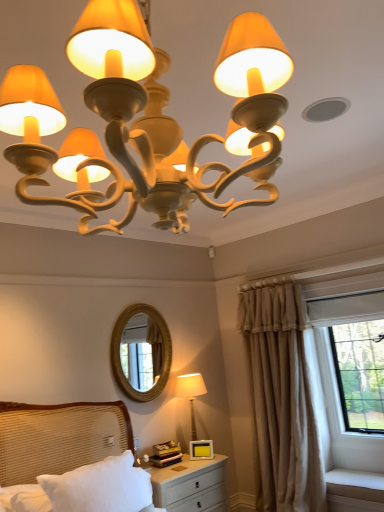
Question: From their relative heights in the image, would you say gold textured mirror at center is taller or shorter than matte cream lamp at lower center, placed as the 2th lamp when sorted from top to bottom?

Choices:
 (A) short
 (B) tall

Answer: (B)

Question: From the image's perspective, is gold textured mirror at center located above or below matte cream lamp at lower center, the 2th lamp positioned from the front?

Choices:
 (A) below
 (B) above

Answer: (B)

Question: Which of these objects is positioned farthest from the white textured bed at lower left?

Choices:
 (A) matte cream chandelier at upper center, the second lamp ordered from the bottom
 (B) matte cream lamp at lower center, the 2th lamp positioned from the front
 (C) beige fabric curtain at right
 (D) white matte nightstand at lower center
 (E) gold textured mirror at center

Answer: (A)

Question: Which object is the farthest from the matte cream lamp at lower center, placed as the 2th lamp when sorted from top to bottom?

Choices:
 (A) matte cream chandelier at upper center, the 2th lamp from the back
 (B) gold textured mirror at center
 (C) white matte nightstand at lower center
 (D) white textured bed at lower left
 (E) beige fabric curtain at right

Answer: (A)